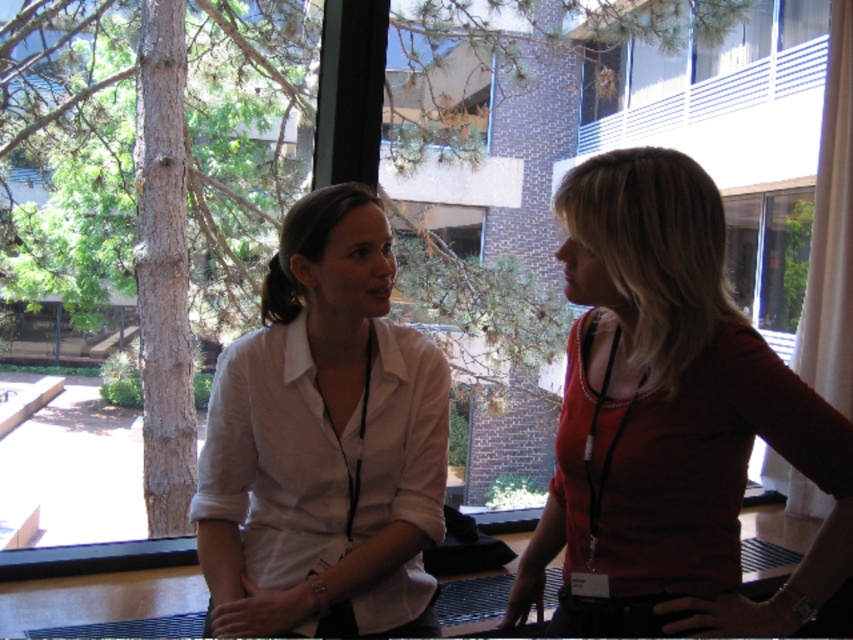
Which is above, matte red blouse at right or white matte shirt at center?

white matte shirt at center is higher up.

Where is `matte red blouse at right`? The image size is (853, 640). matte red blouse at right is located at coordinates (669, 420).

Find the location of `matte red blouse at right`. matte red blouse at right is located at coordinates coord(669,420).